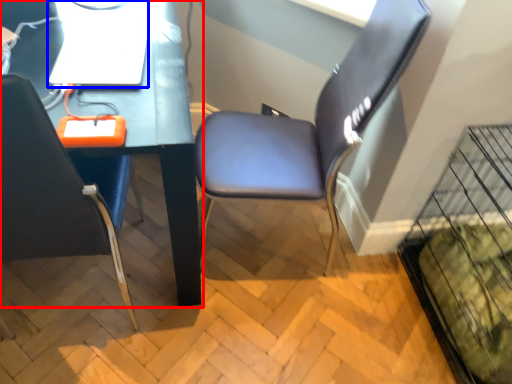
Question: Which object appears closest to the camera in this image, computer desk (highlighted by a red box) or computer (highlighted by a blue box)?

Choices:
 (A) computer desk
 (B) computer

Answer: (A)